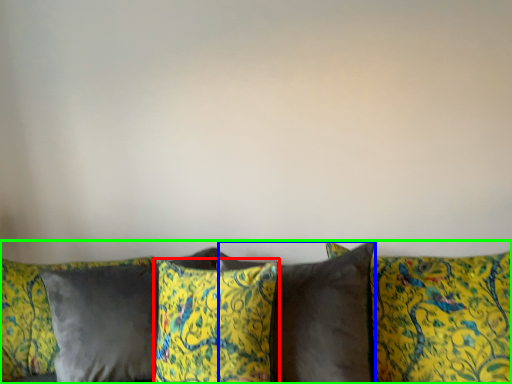
Question: Which object is the closest to the pillow (highlighted by a red box)? Choose among these: pillow (highlighted by a blue box) or studio couch (highlighted by a green box).

Choices:
 (A) pillow
 (B) studio couch

Answer: (A)